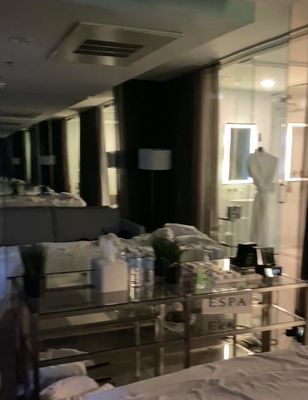
Image resolution: width=308 pixels, height=400 pixels. Identify the location of tissue holder. (120, 273).